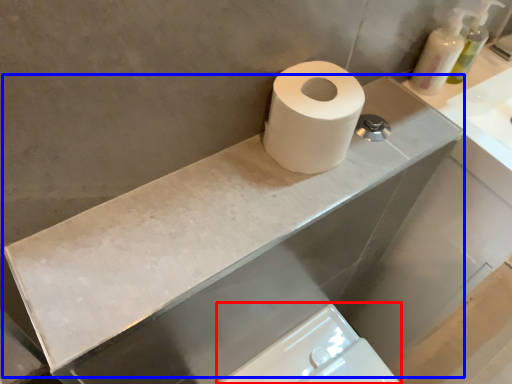
Question: Which of the following is the farthest to the observer, bidet (highlighted by a red box) or counter top (highlighted by a blue box)?

Choices:
 (A) bidet
 (B) counter top

Answer: (A)